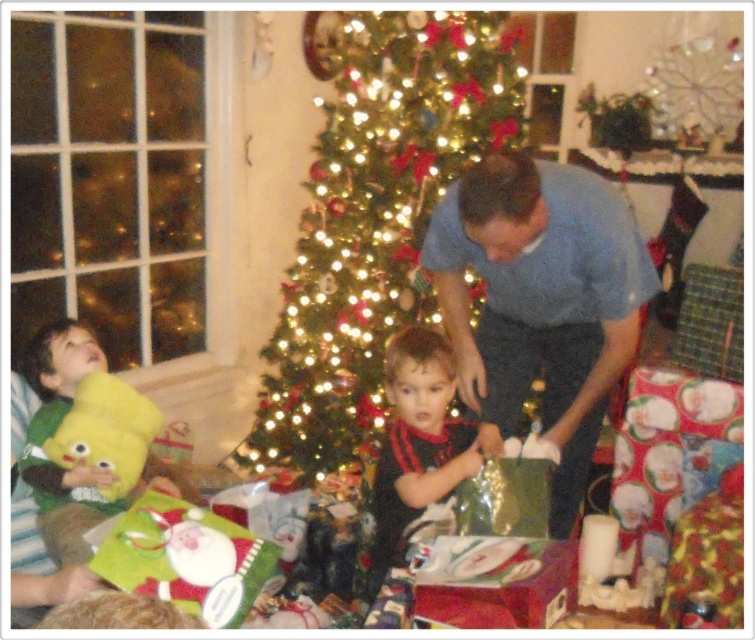
You are a parent trying to organize your childrens shirts before the party. You have two shirts, a blue cotton shirt at center and a black matte shirt at center. If you want to place them side by side on a shelf that is 12 inches wide, will they fit?

The blue cotton shirt at center and black matte shirt at center are 11.14 inches apart, so they will fit on the 12 inch wide shelf since the total width required is less than the shelf width.

You are a parent trying to ensure your child stays safe while playing with the presents under the Christmas tree. Considering the height of the green shiny tree at center and the blue cotton shirt at center, which object is taller and could potentially pose a hazard if the child stands too close?

The green shiny tree at center is much taller than the blue cotton shirt at center, so it could potentially pose a hazard if the child stands too close.